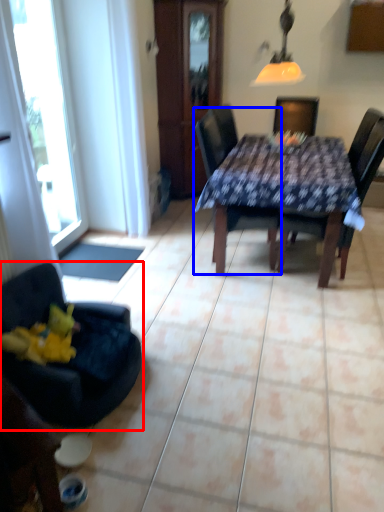
Question: Which object is closer to the camera taking this photo, chair (highlighted by a red box) or chair (highlighted by a blue box)?

Choices:
 (A) chair
 (B) chair

Answer: (A)